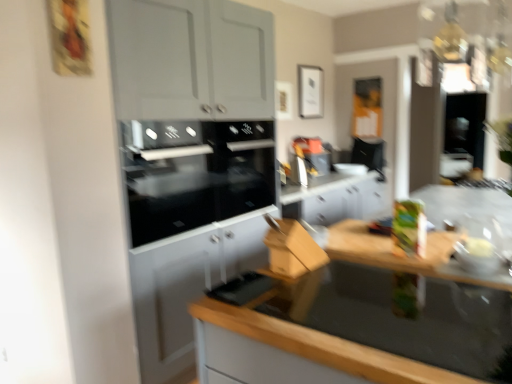
Question: Is wooden at lower right looking in the opposite direction of green matte box at right, which is the 2th appliance from right to left?

Choices:
 (A) no
 (B) yes

Answer: (A)

Question: Considering the relative sizes of wooden at lower right and green matte box at right, acting as the second appliance starting from the back, in the image provided, is wooden at lower right smaller than green matte box at right, acting as the second appliance starting from the back,?

Choices:
 (A) no
 (B) yes

Answer: (A)

Question: Considering the relative sizes of wooden at lower right and green matte box at right, marked as the 2th appliance in a front-to-back arrangement, in the image provided, is wooden at lower right taller than green matte box at right, marked as the 2th appliance in a front-to-back arrangement,?

Choices:
 (A) no
 (B) yes

Answer: (B)

Question: Does wooden at lower right appear on the left side of green matte box at right, the 2th appliance in the left-to-right sequence?

Choices:
 (A) yes
 (B) no

Answer: (A)

Question: Is wooden at lower right at the right side of green matte box at right, the 2th appliance in the left-to-right sequence?

Choices:
 (A) no
 (B) yes

Answer: (A)

Question: Can you confirm if wooden at lower right is shorter than green matte box at right, marked as the 2th appliance in a front-to-back arrangement?

Choices:
 (A) yes
 (B) no

Answer: (B)

Question: Is black glass oven at center, which appears as the first appliance when viewed from the back, wider than wooden at lower right?

Choices:
 (A) yes
 (B) no

Answer: (B)

Question: Is black glass oven at center, which ranks as the first appliance in left-to-right order, not within wooden at lower right?

Choices:
 (A) yes
 (B) no

Answer: (A)

Question: From the image's perspective, is black glass oven at center, which ranks as the first appliance in left-to-right order, beneath wooden at lower right?

Choices:
 (A) yes
 (B) no

Answer: (B)

Question: Are black glass oven at center, which is counted as the third appliance, starting from the front, and wooden at lower right located far from each other?

Choices:
 (A) yes
 (B) no

Answer: (A)

Question: Does black glass oven at center, which is counted as the third appliance, starting from the front, have a lesser height compared to wooden at lower right?

Choices:
 (A) no
 (B) yes

Answer: (B)

Question: Considering the relative positions of black glass oven at center, which appears as the first appliance when viewed from the back, and wooden at lower right in the image provided, is black glass oven at center, which appears as the first appliance when viewed from the back, in front of wooden at lower right?

Choices:
 (A) no
 (B) yes

Answer: (A)

Question: Can you confirm if green matte box at right, acting as the second appliance starting from the back, is positioned to the left of black glass oven at center, which is counted as the third appliance, starting from the front?

Choices:
 (A) yes
 (B) no

Answer: (B)